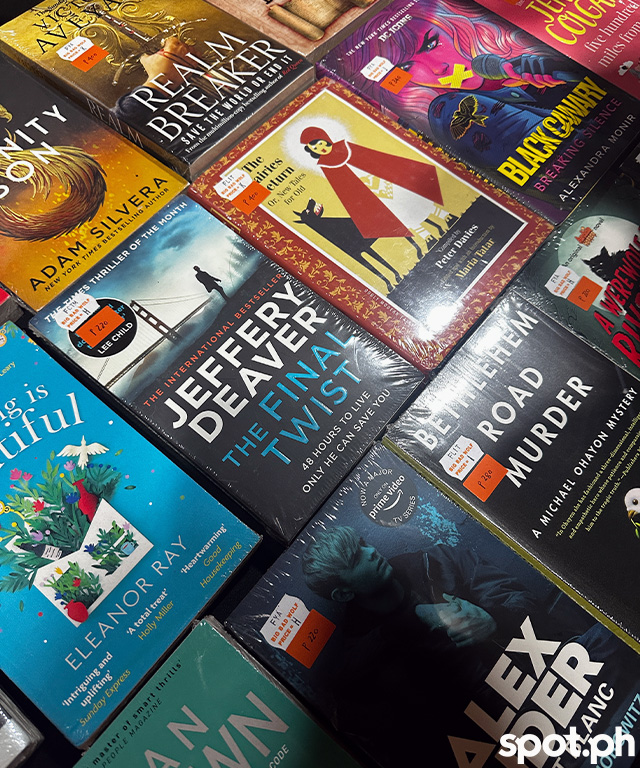
Image resolution: width=640 pixels, height=768 pixels. Identify the location of book. (547, 176).